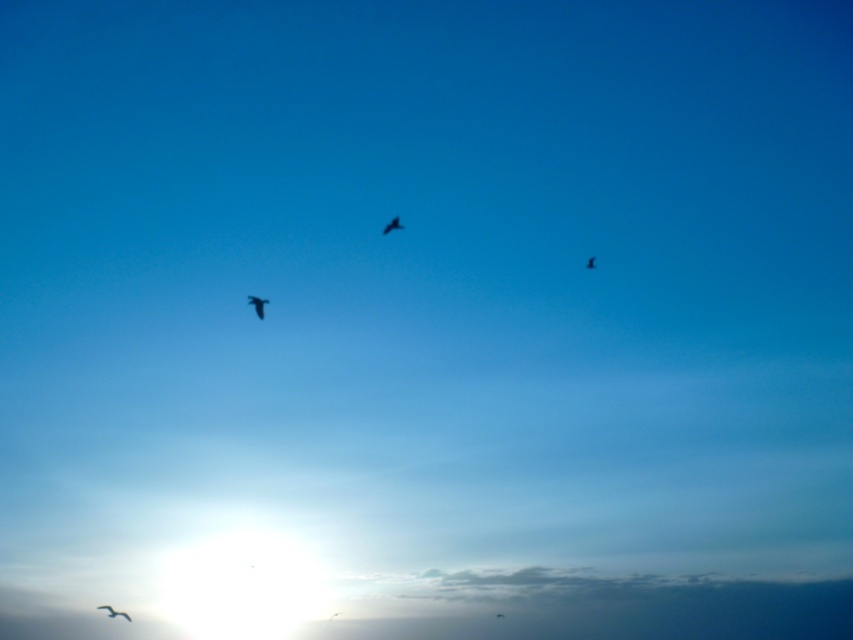
Question: Which point is farther to the camera?

Choices:
 (A) (254, 310)
 (B) (387, 228)
 (C) (109, 611)
 (D) (592, 262)

Answer: (C)

Question: Can you confirm if silhouette feathered bird at center is positioned to the right of black feathered bird at center?

Choices:
 (A) yes
 (B) no

Answer: (B)

Question: Which of the following is the closest to the observer?

Choices:
 (A) silhouette feathered bird at center
 (B) silhouette feathered bird at lower left

Answer: (A)

Question: In this image, where is black feathered bird at center located relative to black matte bird at upper center?

Choices:
 (A) right
 (B) left

Answer: (B)

Question: Which point is farther to the camera?

Choices:
 (A) black matte bird at upper center
 (B) black feathered bird at center
 (C) silhouette feathered bird at center

Answer: (A)

Question: Can you confirm if silhouette feathered bird at lower left is wider than black feathered bird at center?

Choices:
 (A) no
 (B) yes

Answer: (B)